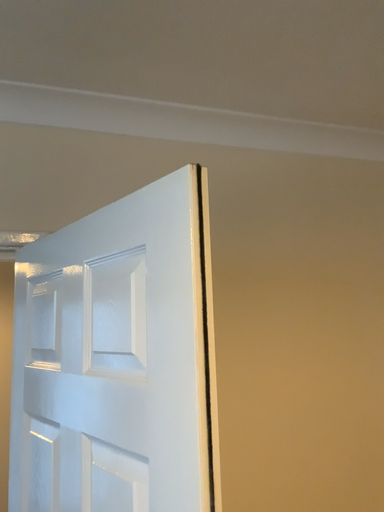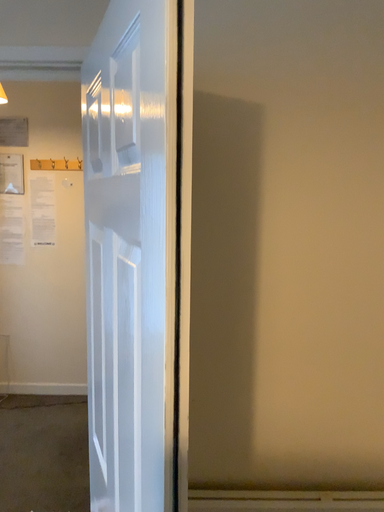
Question: Which way did the camera rotate in the video?

Choices:
 (A) rotated downward
 (B) rotated upward

Answer: (A)